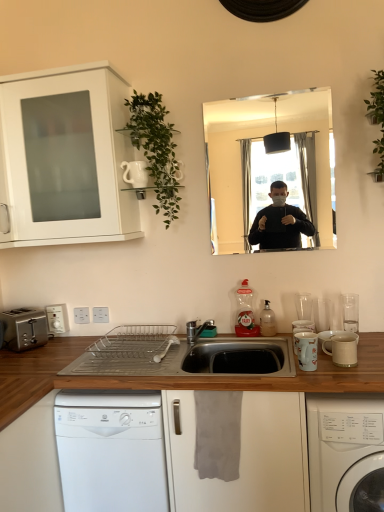
This screenshot has width=384, height=512. What are the coordinates of `free space in front of white glossy mug at right, arranged as the second appliance when viewed from the top` in the screenshot? It's located at (317, 380).